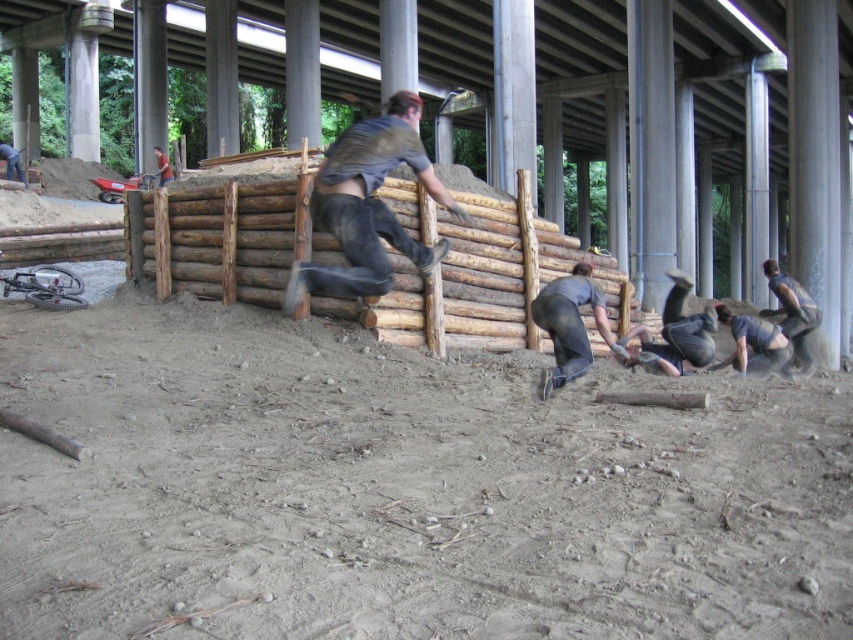
In the scene shown: You are standing at the point labeled point (352, 256) on a construction site under a large overpass. You want to move to the nearest exit, which is located 25 feet away from your current position. Can you reach the exit without moving more than 25 feet?

The distance between point (352, 256) and the viewer is 20.03 feet. Since the exit is 25 feet away, you can reach it without moving more than 25 feet as 20.03 is less than 25.

You are a safety inspector observing the construction site. You notice two workers wearing dark gray fabric pants at lower center and dark gray fabric worker at lower right. Which worker is closer to the ground based on their clothing?

The dark gray fabric pants at lower center is shorter than the dark gray fabric worker at lower right, indicating that the worker with the shorter pants is closer to the ground.